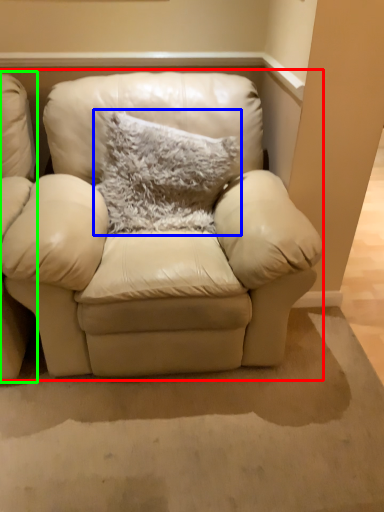
Question: Which object is the closest to the studio couch (highlighted by a red box)? Choose among these: pillow (highlighted by a blue box) or chair (highlighted by a green box).

Choices:
 (A) pillow
 (B) chair

Answer: (A)